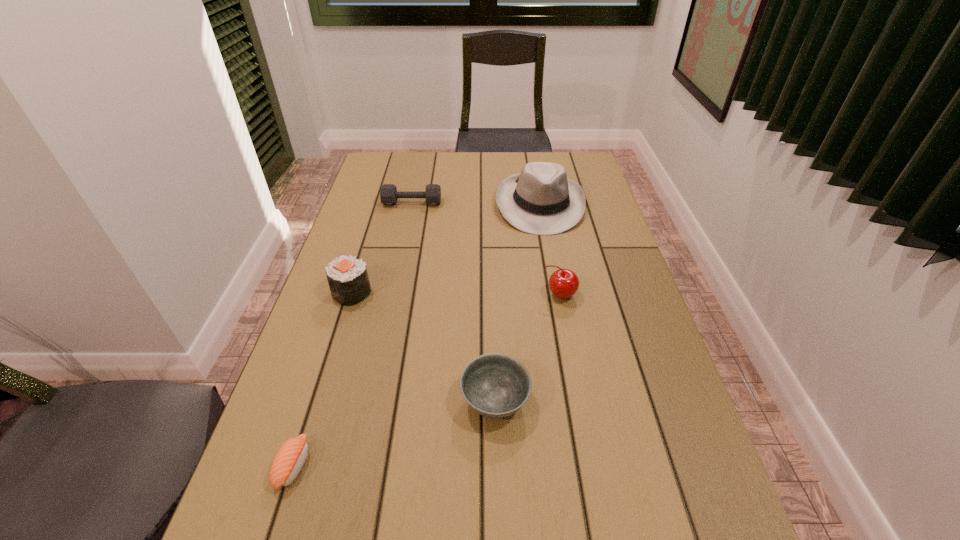
Identify the location of fedora. The image size is (960, 540). (541, 200).

Where is `cherry`? The height and width of the screenshot is (540, 960). cherry is located at coordinates (563, 283).

In order to click on the taller sushi in this screenshot , I will do `click(348, 279)`.

Locate an element on the screen. This screenshot has height=540, width=960. the second nearest object is located at coordinates (495, 385).

Identify the location of dumbbell. (388, 192).

At what (x,y) coordinates should I click in order to perform the action: click on the shortest object. Please return your answer as a coordinate pair (x, y). This screenshot has width=960, height=540. Looking at the image, I should click on (290, 458).

The height and width of the screenshot is (540, 960). What are the coordinates of `the nearest object` in the screenshot? It's located at tap(290, 458).

Where is `vacant space located on the front-facing side of the tallest object`? The height and width of the screenshot is (540, 960). vacant space located on the front-facing side of the tallest object is located at coordinates (547, 246).

Image resolution: width=960 pixels, height=540 pixels. In order to click on vacant area situated 0.320m on the left of the cherry in this screenshot , I will do `click(420, 295)`.

Identify the location of free location located on the back of the taller sushi. Image resolution: width=960 pixels, height=540 pixels. (365, 252).